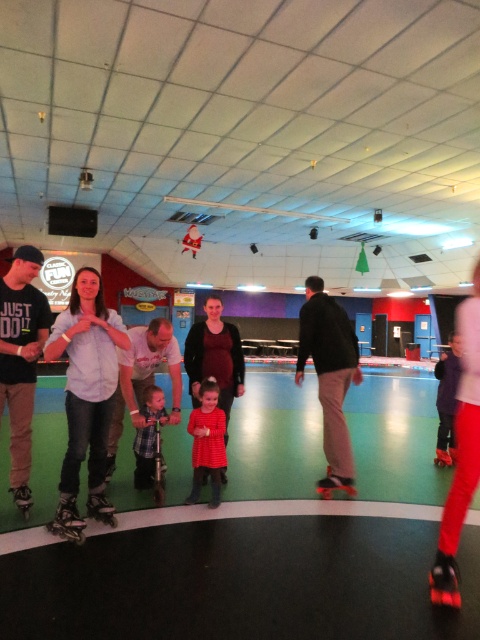
You are standing at the entrance of the roller skating rink and see the matte brown skateboard at center. If you want to reach it, which direction should you move in?

You should move towards the center of the roller skating rink to reach the matte brown skateboard at center.

You are a visitor at the roller skating rink and want to place your belongings on the floor near the center. There is a matte brown skateboard at center and a matte black roller skate at lower left. Which object is taller so you can place your items on top of it?

The matte brown skateboard at center is taller than the matte black roller skate at lower left, so you can place your items on top of the matte brown skateboard at center.

You are planning to buy a gift for a friend who loves outdoor activities. You see a matte brown skateboard at center and a matte black roller skate at lower left in the rink. Which item would be more suitable for outdoor use based on their sizes?

The matte brown skateboard at center is larger in size than the matte black roller skate at lower left, so it would be more suitable for outdoor use as larger items often provide better stability and control.